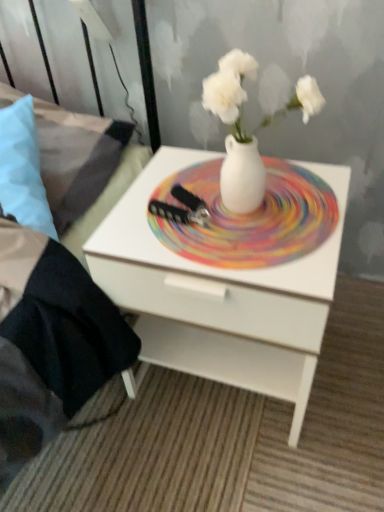
The image size is (384, 512). Identify the location of vacant location behind white matte vase at center. (222, 162).